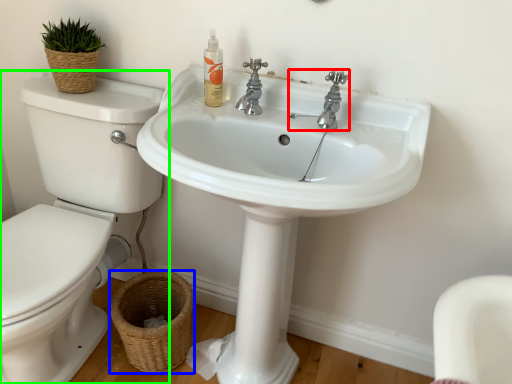
Question: Based on their relative distances, which object is nearer to tap (highlighted by a red box)? Choose from basket (highlighted by a blue box) and toilet (highlighted by a green box).

Choices:
 (A) basket
 (B) toilet

Answer: (B)